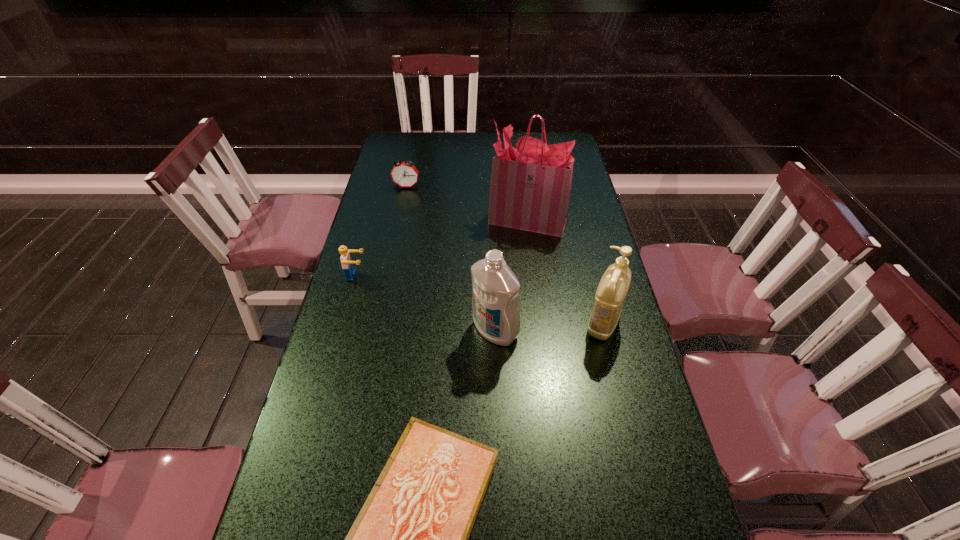
Locate an element on the screen. This screenshot has width=960, height=540. the second farthest object is located at coordinates (530, 189).

This screenshot has width=960, height=540. What are the coordinates of `the tallest object` in the screenshot? It's located at (530, 189).

The image size is (960, 540). Identify the location of the left detergent. (495, 299).

I want to click on the taller detergent, so click(495, 299).

At what (x,y) coordinates should I click in order to perform the action: click on the right detergent. Please return your answer as a coordinate pair (x, y). This screenshot has height=540, width=960. Looking at the image, I should click on coord(614,284).

Identify the location of the shorter detergent. The height and width of the screenshot is (540, 960). (614, 284).

Where is `alarm clock`? The height and width of the screenshot is (540, 960). alarm clock is located at coordinates (404, 174).

Where is `the third farthest object`? The width and height of the screenshot is (960, 540). the third farthest object is located at coordinates (347, 264).

I want to click on Lego, so 347,264.

This screenshot has height=540, width=960. Find the location of `free location located 0.390m on the back of the tallest object`. free location located 0.390m on the back of the tallest object is located at coordinates (519, 151).